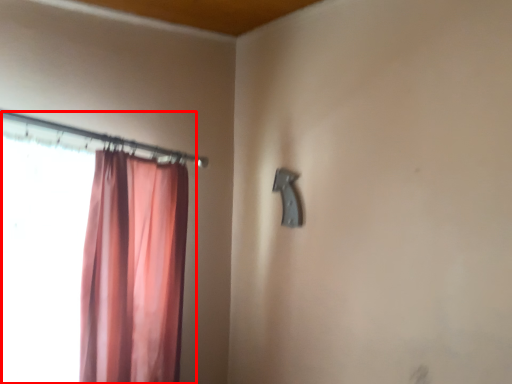
Question: From the image's perspective, what is the correct spatial relationship of curtain (annotated by the red box) in relation to door handle?

Choices:
 (A) above
 (B) below

Answer: (B)